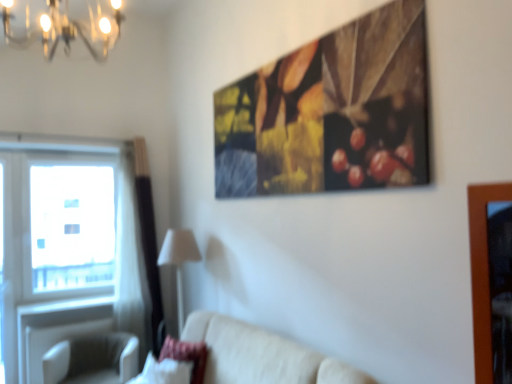
I want to click on transparent glass window at left, so click(72, 227).

The height and width of the screenshot is (384, 512). What do you see at coordinates (62, 25) in the screenshot?
I see `metallic chandelier at upper left` at bounding box center [62, 25].

Measure the distance between point (92,336) and camera.

Point (92,336) is 3.79 meters from camera.

Measure the distance between beige fabric swivel chair at lower left and camera.

A distance of 3.31 meters exists between beige fabric swivel chair at lower left and camera.

Where is `white fabric lampshade at lower center`? This screenshot has width=512, height=384. white fabric lampshade at lower center is located at coordinates (179, 261).

Considering the relative sizes of white fabric lampshade at lower center and beige fabric couch at lower center in the image provided, is white fabric lampshade at lower center smaller than beige fabric couch at lower center?

Yes, white fabric lampshade at lower center is smaller than beige fabric couch at lower center.

Considering the relative sizes of white fabric lampshade at lower center and beige fabric couch at lower center in the image provided, is white fabric lampshade at lower center shorter than beige fabric couch at lower center?

No.

Is white fabric lampshade at lower center spatially inside beige fabric couch at lower center, or outside of it?

white fabric lampshade at lower center is not inside beige fabric couch at lower center, it's outside.

Consider the image. Is white fabric lampshade at lower center not near beige fabric couch at lower center?

No, white fabric lampshade at lower center is in close proximity to beige fabric couch at lower center.

From the picture: Does transparent glass window at left have a greater height compared to velvet pink pillow at lower left?

Yes.

Is transparent glass window at left closer to the viewer compared to velvet pink pillow at lower left?

No.

How far apart are transparent glass window at left and velvet pink pillow at lower left?

transparent glass window at left is 1.75 meters from velvet pink pillow at lower left.

Is transparent glass window at left not close to velvet pink pillow at lower left?

Yes.

Could you tell me if white fabric lampshade at lower center is facing beige fabric swivel chair at lower left?

Yes, white fabric lampshade at lower center is aimed at beige fabric swivel chair at lower left.

Considering the points (168, 244) and (76, 355), which point is in front, point (168, 244) or point (76, 355)?

Point (168, 244)

Is white fabric lampshade at lower center wider than beige fabric swivel chair at lower left?

No, white fabric lampshade at lower center is not wider than beige fabric swivel chair at lower left.

In the scene shown: From a real-world perspective, is white fabric lampshade at lower center located higher than beige fabric swivel chair at lower left?

Yes, from a real-world perspective, white fabric lampshade at lower center is above beige fabric swivel chair at lower left.

Is metallic chandelier at upper left located outside white fabric lampshade at lower center?

Absolutely, metallic chandelier at upper left is external to white fabric lampshade at lower center.

From a real-world perspective, is metallic chandelier at upper left physically located above or below white fabric lampshade at lower center?

Clearly, from a real-world perspective, metallic chandelier at upper left is above white fabric lampshade at lower center.

From the image's perspective, between metallic chandelier at upper left and white fabric lampshade at lower center, which one is located above?

metallic chandelier at upper left, from the image's perspective.

Can you confirm if metallic chandelier at upper left is taller than white fabric lampshade at lower center?

No, metallic chandelier at upper left is not taller than white fabric lampshade at lower center.

Is velvet pink pillow at lower left in front of or behind beige fabric swivel chair at lower left in the image?

Visually, velvet pink pillow at lower left is located in front of beige fabric swivel chair at lower left.

From the image's perspective, relative to beige fabric swivel chair at lower left, is velvet pink pillow at lower left above or below?

velvet pink pillow at lower left is above beige fabric swivel chair at lower left.

From a real-world perspective, relative to beige fabric swivel chair at lower left, is velvet pink pillow at lower left vertically above or below?

In terms of real-world spatial position, velvet pink pillow at lower left is above beige fabric swivel chair at lower left.

Between point (203, 369) and point (48, 352), which one is positioned in front?

The point (203, 369) is closer.

How much distance is there between beige fabric couch at lower center and velvet pink pillow at lower left?

beige fabric couch at lower center is 35.62 centimeters away from velvet pink pillow at lower left.

Can you tell me how much beige fabric couch at lower center and velvet pink pillow at lower left differ in facing direction?

The facing directions of beige fabric couch at lower center and velvet pink pillow at lower left are 32.8 degrees apart.

Is beige fabric couch at lower center facing away from velvet pink pillow at lower left?

Yes, beige fabric couch at lower center's orientation is away from velvet pink pillow at lower left.

Considering the positions of points (333, 369) and (188, 382), is point (333, 369) closer to camera compared to point (188, 382)?

Yes, it is in front of point (188, 382).

Who is shorter, metallic chandelier at upper left or beige fabric swivel chair at lower left?

metallic chandelier at upper left is shorter.

Is metallic chandelier at upper left inside the boundaries of beige fabric swivel chair at lower left, or outside?

metallic chandelier at upper left cannot be found inside beige fabric swivel chair at lower left.

Find the location of `swivel chair behind the metallic chandelier at upper left`. swivel chair behind the metallic chandelier at upper left is located at coordinates (92, 359).

You are a GUI agent. You are given a task and a screenshot of the screen. Output one action in this format:
    pyautogui.click(x=<x>, y=<y>)
    Task: Click on the lamp above the beige fabric couch at lower center (from the image's perspective)
    This screenshot has width=512, height=384.
    Given the screenshot: What is the action you would take?
    pyautogui.click(x=179, y=261)

You are a GUI agent. You are given a task and a screenshot of the screen. Output one action in this format:
    pyautogui.click(x=<x>, y=<y>)
    Task: Click on the pillow in front of the transparent glass window at left
    Image resolution: width=512 pixels, height=384 pixels.
    Given the screenshot: What is the action you would take?
    pyautogui.click(x=175, y=364)

Based on their spatial positions, is velvet pink pillow at lower left or white fabric lampshade at lower center further from transparent glass window at left?

Based on the image, velvet pink pillow at lower left appears to be further to transparent glass window at left.

Based on their spatial positions, is metallic chandelier at upper left or velvet pink pillow at lower left closer to beige fabric couch at lower center?

Among the two, velvet pink pillow at lower left is located nearer to beige fabric couch at lower center.

Estimate the real-world distances between objects in this image. Which object is closer to transparent glass window at left, transparent glass window at left or velvet pink pillow at lower left?

The object closer to transparent glass window at left is transparent glass window at left.

Considering their positions, is velvet pink pillow at lower left positioned closer to transparent glass window at left than beige fabric couch at lower center?

velvet pink pillow at lower left.

Looking at the image, which one is located further to transparent glass window at left, white fabric lampshade at lower center or beige fabric swivel chair at lower left?

white fabric lampshade at lower center is positioned further to the anchor transparent glass window at left.

Estimate the real-world distances between objects in this image. Which object is closer to velvet pink pillow at lower left, transparent glass window at left or white fabric lampshade at lower center?

Based on the image, white fabric lampshade at lower center appears to be nearer to velvet pink pillow at lower left.

From the picture: When comparing their distances from beige fabric swivel chair at lower left, does transparent glass window at left or beige fabric couch at lower center seem closer?

Based on the image, transparent glass window at left appears to be nearer to beige fabric swivel chair at lower left.

Which object lies nearer to the anchor point velvet pink pillow at lower left, metallic chandelier at upper left or white fabric lampshade at lower center?

white fabric lampshade at lower center lies closer to velvet pink pillow at lower left than the other object.

Where is `studio couch between metallic chandelier at upper left and velvet pink pillow at lower left from top to bottom`? Image resolution: width=512 pixels, height=384 pixels. studio couch between metallic chandelier at upper left and velvet pink pillow at lower left from top to bottom is located at coordinates (261, 355).

I want to click on window between transparent glass window at left and white fabric lampshade at lower center, so click(x=65, y=217).

Image resolution: width=512 pixels, height=384 pixels. In order to click on swivel chair between beige fabric couch at lower center and transparent glass window at left in the front-back direction in this screenshot , I will do `click(92, 359)`.

The width and height of the screenshot is (512, 384). In order to click on swivel chair located between metallic chandelier at upper left and transparent glass window at left in the depth direction in this screenshot , I will do `click(92, 359)`.